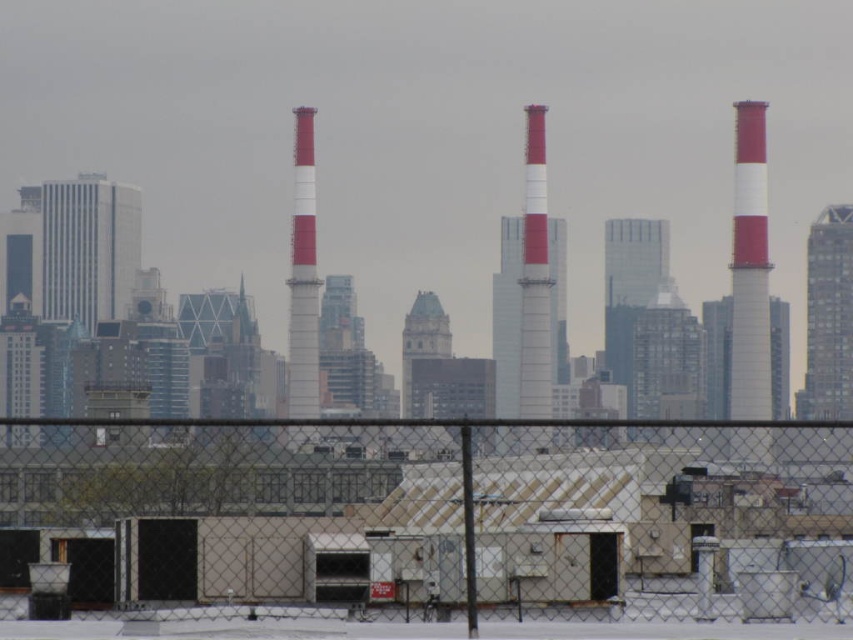
You are a drone operator who needs to fly a drone over the chain link fence at lower center to capture aerial footage of the industrial chimneys. The drone has a maximum flight distance of 500 meters. Based on the scene, will the drone be able to reach the fence and capture the footage?

The chain link fence at lower center is 648.72 meters away from the viewer. Since the drone can only fly up to 500 meters, it cannot reach the fence and capture the footage.

You are standing in front of the scene described. You want to take a photo of the white striped chimney at center without the chain link fence at lower center appearing in the frame. Is this possible based on their positions?

The chain link fence at lower center is positioned under the white striped chimney at center, so it is blocking the base of the chimney. To avoid the fence in the photo, you would need to adjust your angle or move higher to frame the chimney above the fence.